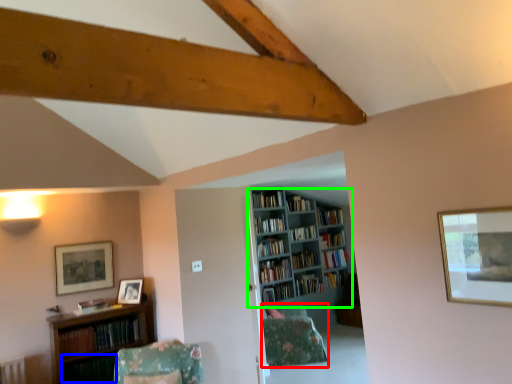
Question: Which object is the closest to the pillow (highlighted by a red box)? Choose among these: book (highlighted by a blue box) or bookcase (highlighted by a green box).

Choices:
 (A) book
 (B) bookcase

Answer: (B)